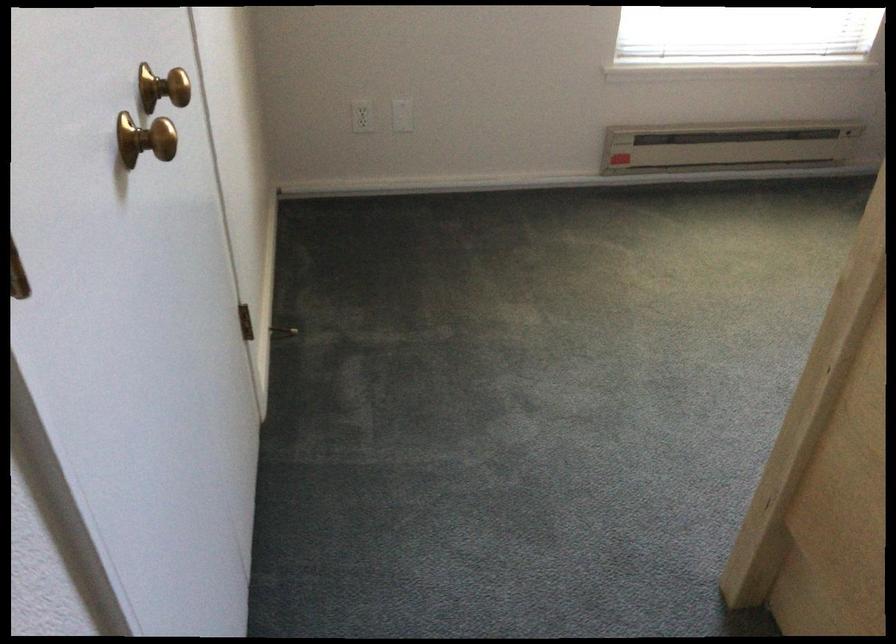
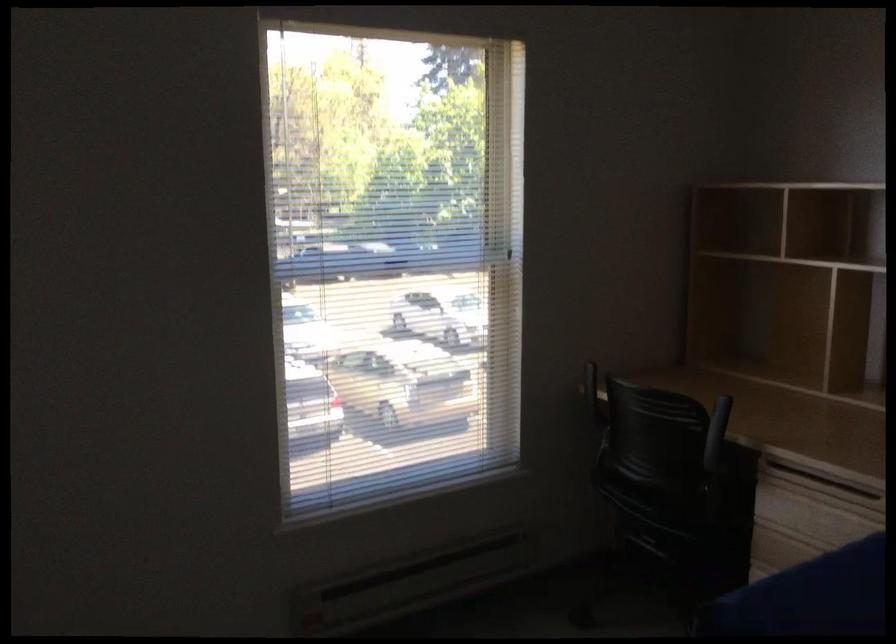
Based on the continuous images, in which direction is the camera rotating?

The rotation direction of the camera is right-up.